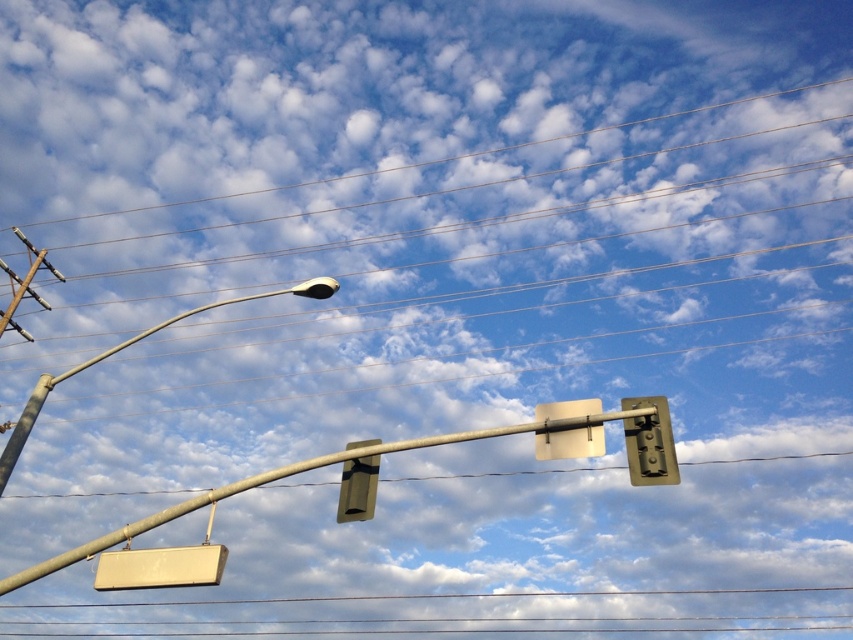
You are a pedestrian standing at the intersection and want to cross the road. You see the white matte sign at lower left and the metallic traffic light at center. Which object is closer to your left side?

The white matte sign at lower left is closer to your left side since it is positioned to the left of the metallic traffic light at center.

You are a delivery driver who needs to read a sign while driving. You see the white matte sign at lower left and the metallic traffic light at center. Which object is bigger in size?

The white matte sign at lower left has a larger size compared to the metallic traffic light at center, so the white matte sign at lower left is bigger.

You are a technician who needs to inspect both the sleek metallic street light at upper left and the camera. Given that your ladder can only reach up to 10 meters, can you safely inspect both without moving the ladder?

The sleek metallic street light at upper left and camera are 12.31 meters apart from each other, so the ladder cannot reach both since it can only extend up to 10 meters. You will need to move the ladder to inspect each separately.